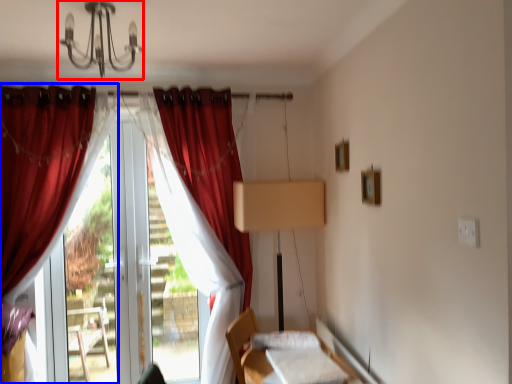
Question: Among these objects, which one is farthest to the camera, light fixture (highlighted by a red box) or curtain (highlighted by a blue box)?

Choices:
 (A) light fixture
 (B) curtain

Answer: (B)